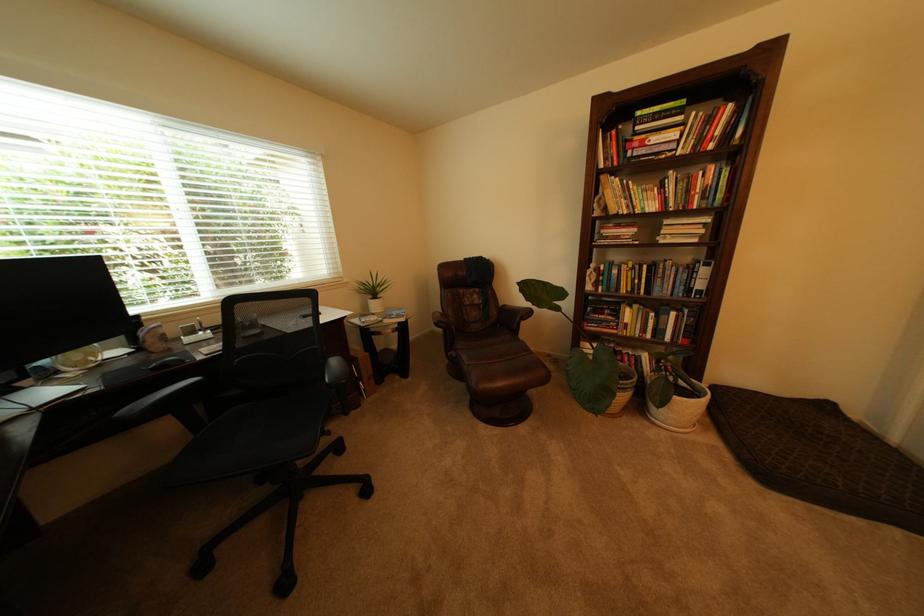
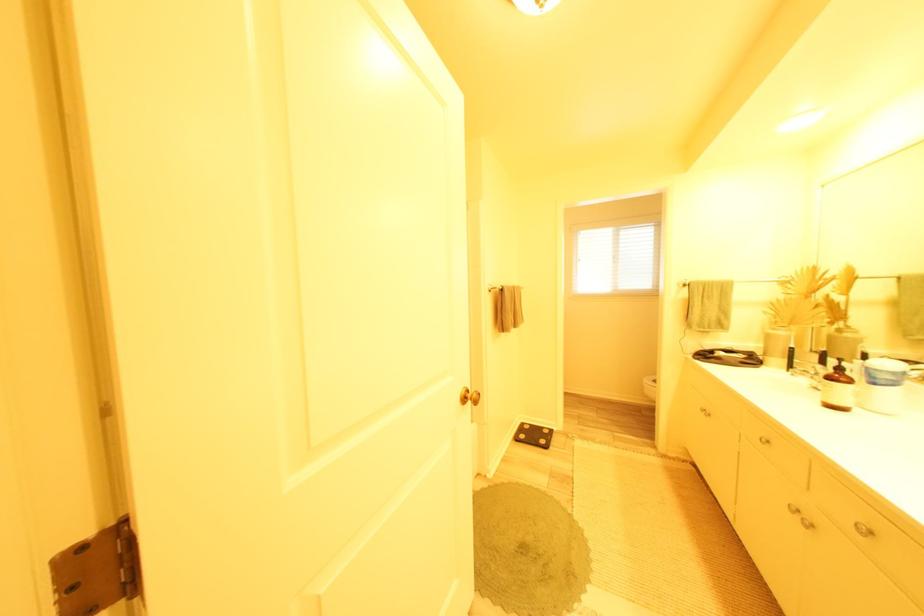
The images are taken continuously from a first-person perspective. In which direction are you moving?

The cameraman walked toward right, backward.